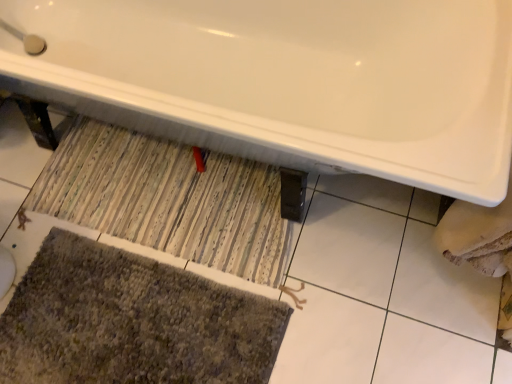
Locate an element on the screen. free space to the left of striped fabric doormat at center is located at coordinates (41, 225).